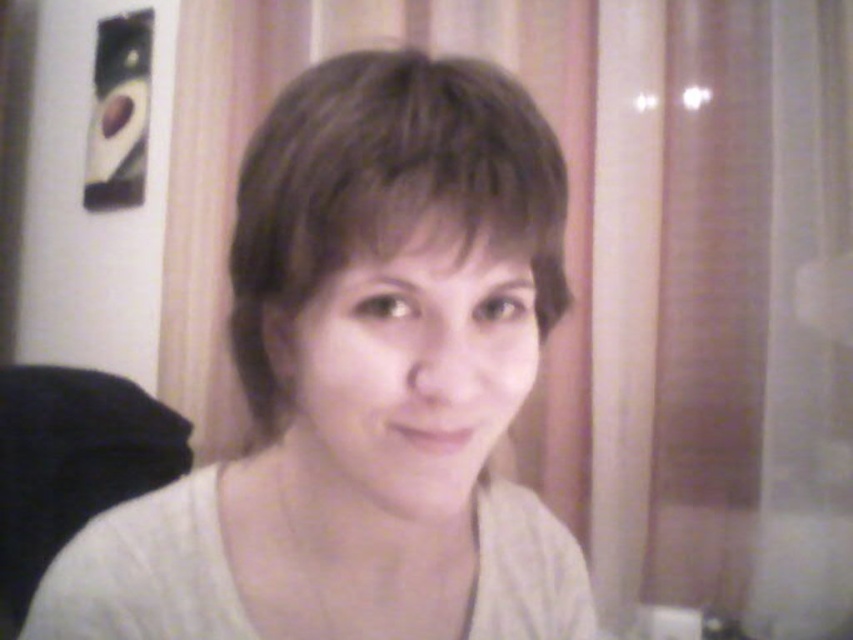
Is point (281, 320) less distant than point (515, 179)?

No, it is behind (515, 179).

Is white matte shirt at center closer to camera compared to brown matte hair at center?

Yes.

Who is more forward, (321, 179) or (364, 236)?

Point (364, 236) is in front.

Find the location of a particular element. The image size is (853, 640). white matte shirt at center is located at coordinates [x=364, y=385].